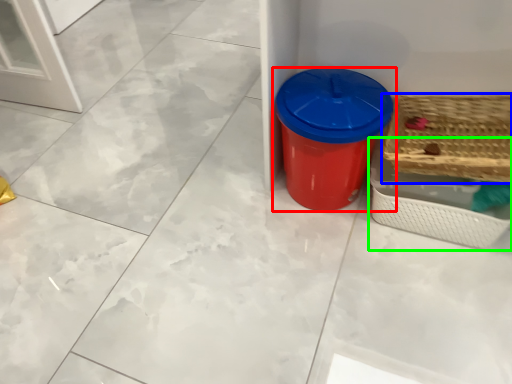
Question: Estimate the real-world distances between objects in this image. Which object is farther from waste container (highlighted by a red box), basket (highlighted by a blue box) or basket (highlighted by a green box)?

Choices:
 (A) basket
 (B) basket

Answer: (A)